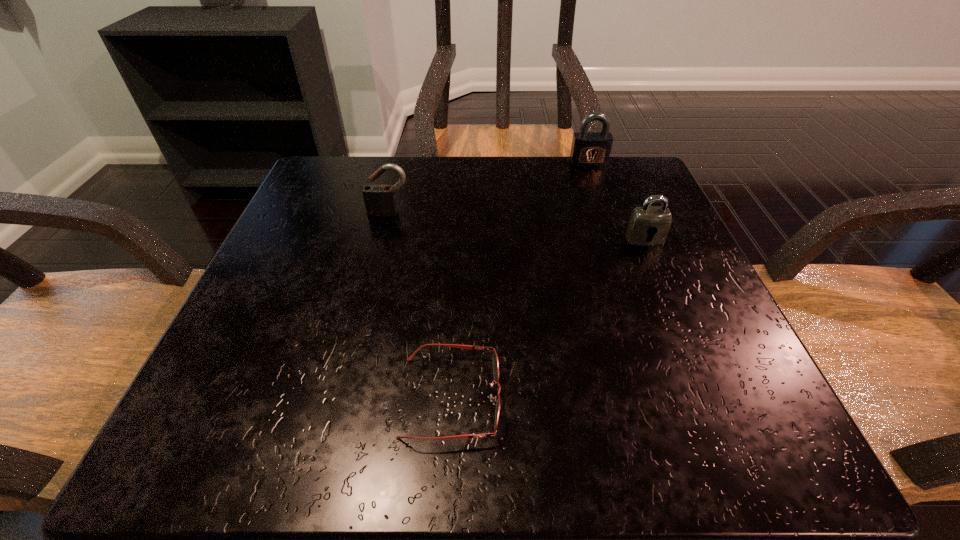
The width and height of the screenshot is (960, 540). Identify the location of object that is at the near edge. (495, 358).

The height and width of the screenshot is (540, 960). I want to click on object positioned at the left edge, so click(x=380, y=200).

At what (x,y) coordinates should I click in order to perform the action: click on object at the far left corner. Please return your answer as a coordinate pair (x, y). Looking at the image, I should click on (x=380, y=200).

Locate an element on the screen. Image resolution: width=960 pixels, height=540 pixels. object positioned at the far right corner is located at coordinates (589, 149).

In the image, there is a desktop. Identify the location of vacant region at the far edge. 433,182.

This screenshot has height=540, width=960. I want to click on vacant space at the left edge, so click(x=315, y=316).

Image resolution: width=960 pixels, height=540 pixels. I want to click on vacant space at the right edge of the desktop, so click(705, 363).

The height and width of the screenshot is (540, 960). I want to click on free location at the far left corner of the desktop, so click(351, 212).

In the image, there is a desktop. Where is `blank space at the near left corner`? Image resolution: width=960 pixels, height=540 pixels. blank space at the near left corner is located at coordinates (224, 449).

Find the location of a particular element. Image resolution: width=960 pixels, height=540 pixels. free location at the far right corner of the desktop is located at coordinates (646, 181).